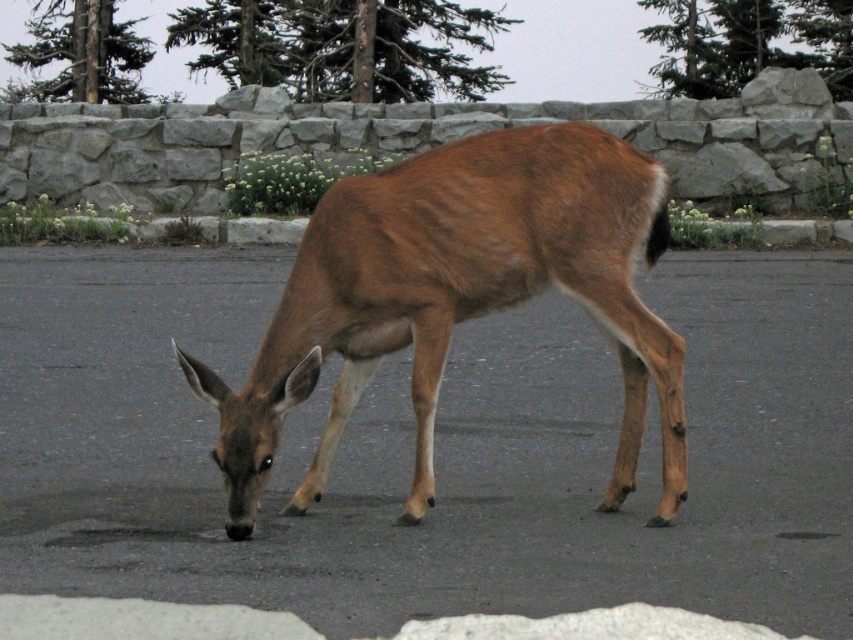
Is brown fur deer at center bigger than brown furry deer at center?

Yes, brown fur deer at center is bigger than brown furry deer at center.

Who is positioned more to the right, brown fur deer at center or brown furry deer at center?

Positioned to the right is brown fur deer at center.

Between point (4, 371) and point (412, 364), which one is positioned in front?

Positioned in front is point (412, 364).

This screenshot has width=853, height=640. I want to click on brown fur deer at center, so click(434, 449).